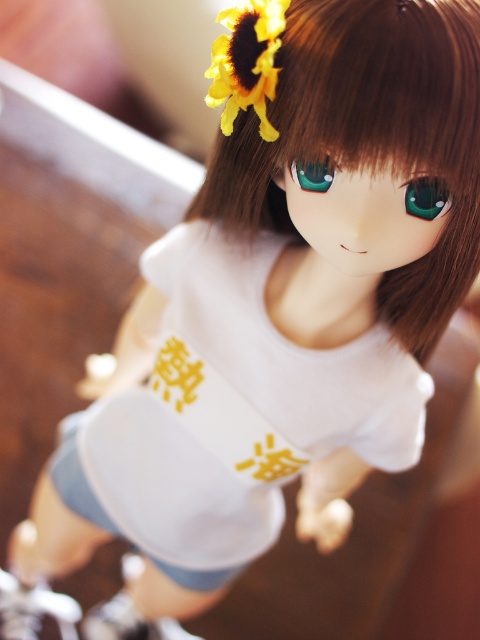
The width and height of the screenshot is (480, 640). What are the coordinates of `white matte t-shirt at center` in the screenshot? It's located at (230, 413).

Does point (202, 227) come in front of point (220, 54)?

No, (202, 227) is behind (220, 54).

Who is more distant from viewer, (173, 504) or (243, 51)?

The point (173, 504) is more distant.

Where is `white matte t-shirt at center`? The height and width of the screenshot is (640, 480). white matte t-shirt at center is located at coordinates (230, 413).

Between brown smooth hair at center and yellow matte sunflower at upper center, which one appears on the right side from the viewer's perspective?

brown smooth hair at center is more to the right.

Which is behind, point (422, 353) or point (243, 83)?

The point (422, 353) is behind.

The height and width of the screenshot is (640, 480). Identify the location of brown smooth hair at center. (369, 134).

Where is `brown smooth hair at center`? This screenshot has height=640, width=480. brown smooth hair at center is located at coordinates (369, 134).

Does white matte t-shirt at center have a greater width compared to brown smooth hair at center?

Indeed, white matte t-shirt at center has a greater width compared to brown smooth hair at center.

Image resolution: width=480 pixels, height=640 pixels. What do you see at coordinates (230, 413) in the screenshot?
I see `white matte t-shirt at center` at bounding box center [230, 413].

Find the location of `white matte t-shirt at center`. white matte t-shirt at center is located at coordinates (230, 413).